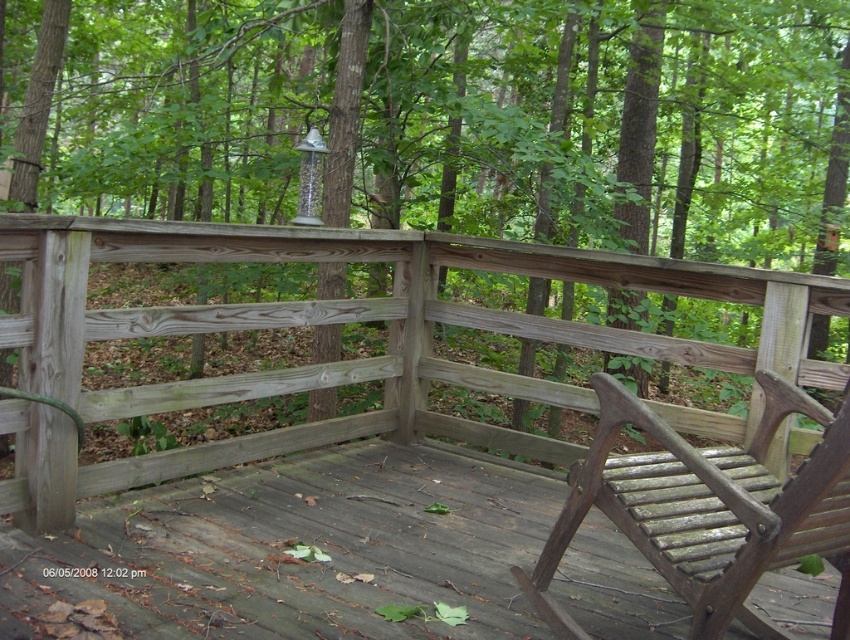
Question: Which is farther from the brown wood tree at center?

Choices:
 (A) weathered wood deck at center
 (B) wooden slats chair at lower right
 (C) weathered wood porch at center

Answer: (B)

Question: Is weathered wood deck at center to the right of wooden slats chair at lower right from the viewer's perspective?

Choices:
 (A) no
 (B) yes

Answer: (A)

Question: Is weathered wood porch at center smaller than wooden slats chair at lower right?

Choices:
 (A) no
 (B) yes

Answer: (A)

Question: Can you confirm if weathered wood porch at center is smaller than weathered wood deck at center?

Choices:
 (A) no
 (B) yes

Answer: (A)

Question: Which object is positioned farthest from the wooden slats chair at lower right?

Choices:
 (A) weathered wood porch at center
 (B) brown wood tree at center

Answer: (B)

Question: Which of these objects is positioned farthest from the weathered wood porch at center?

Choices:
 (A) wooden slats chair at lower right
 (B) weathered wood deck at center

Answer: (A)